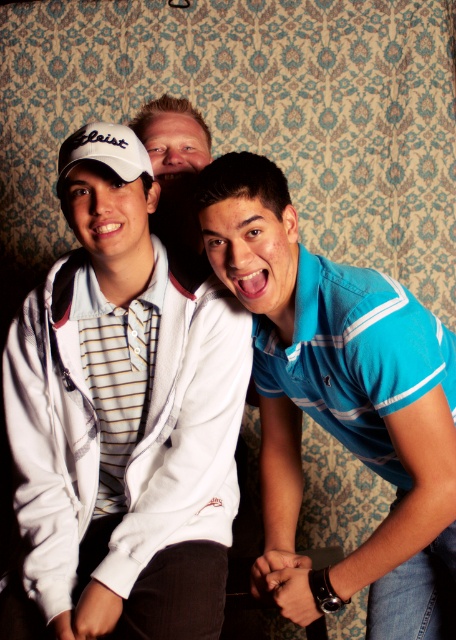
Can you confirm if white matte jacket at center is shorter than matte white cap at center?

No, white matte jacket at center is not shorter than matte white cap at center.

Describe the element at coordinates (122, 417) in the screenshot. The height and width of the screenshot is (640, 456). I see `white matte jacket at center` at that location.

The image size is (456, 640). I want to click on white matte jacket at center, so click(122, 417).

Between white matte jacket at center and blue cotton polo shirt at center, which one appears on the left side from the viewer's perspective?

white matte jacket at center

Is point (17, 512) positioned behind point (310, 284)?

Yes, point (17, 512) is behind point (310, 284).

I want to click on white matte jacket at center, so click(x=122, y=417).

Does white matte jacket at center have a smaller size compared to white matte baseball cap at upper left?

No, white matte jacket at center is not smaller than white matte baseball cap at upper left.

What do you see at coordinates (122, 417) in the screenshot? I see `white matte jacket at center` at bounding box center [122, 417].

Is point (77, 180) farther from viewer compared to point (88, 140)?

Yes, it is.

You are a GUI agent. You are given a task and a screenshot of the screen. Output one action in this format:
    pyautogui.click(x=<x>, y=<y>)
    Task: Click on the white matte jacket at center
    The image size is (456, 640).
    Given the screenshot: What is the action you would take?
    pyautogui.click(x=122, y=417)